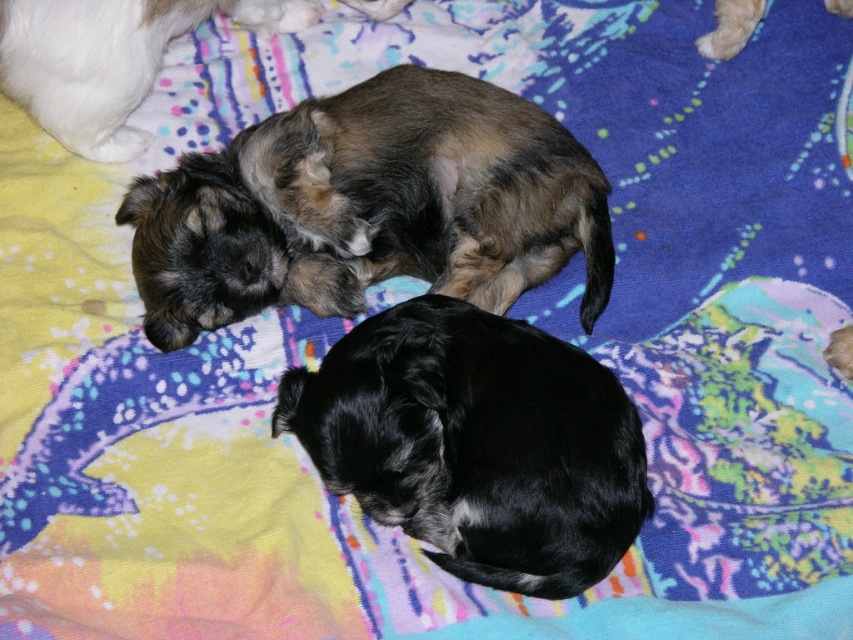
Question: Which object is the closest to the brown fuzzy puppy at upper left?

Choices:
 (A) brown fuzzy dog at center
 (B) light brown fur at upper right
 (C) black fur dog at center

Answer: (A)

Question: Is brown fuzzy dog at center positioned before black fur dog at center?

Choices:
 (A) yes
 (B) no

Answer: (B)

Question: Considering the real-world distances, which object is closest to the light brown fur at upper right?

Choices:
 (A) black fur dog at center
 (B) brown fuzzy puppy at upper left
 (C) brown fuzzy dog at center

Answer: (C)

Question: Can you confirm if brown fuzzy puppy at upper left is thinner than light brown fur at upper right?

Choices:
 (A) yes
 (B) no

Answer: (B)

Question: Among these objects, which one is farthest from the camera?

Choices:
 (A) brown fuzzy puppy at upper left
 (B) brown fuzzy dog at center

Answer: (B)

Question: Does brown fuzzy dog at center appear on the right side of black fur dog at center?

Choices:
 (A) yes
 (B) no

Answer: (B)